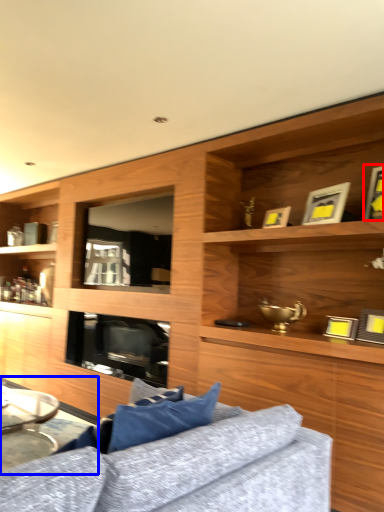
Question: Which object appears farthest to the camera in this image, picture frame (highlighted by a red box) or table (highlighted by a blue box)?

Choices:
 (A) picture frame
 (B) table

Answer: (B)